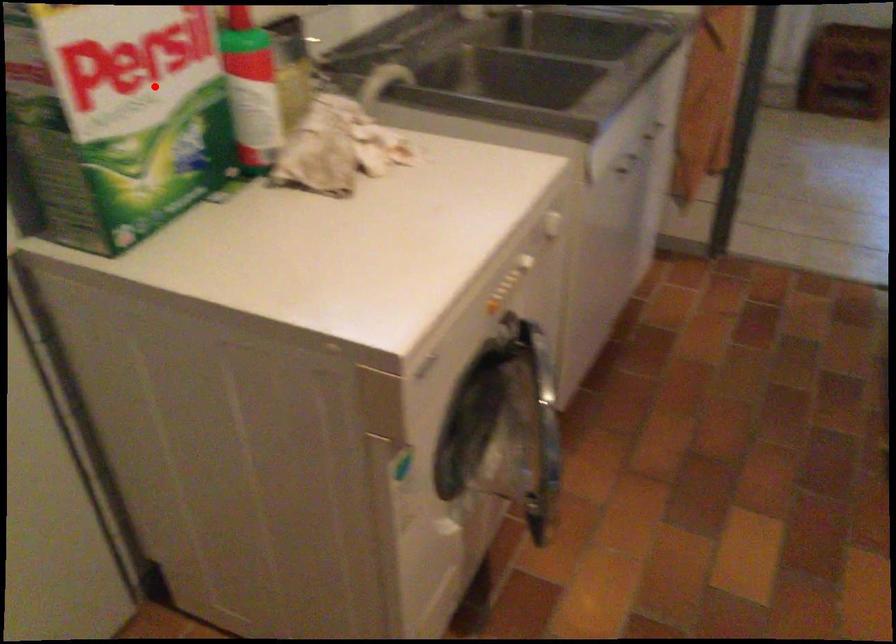
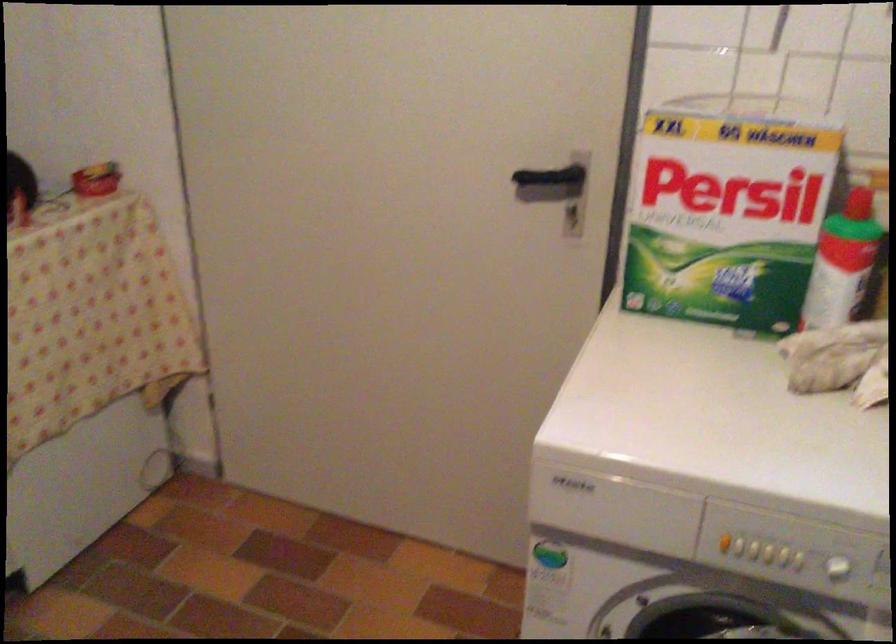
In the second image, find the point that corresponds to the highlighted location in the first image.

(728, 210)